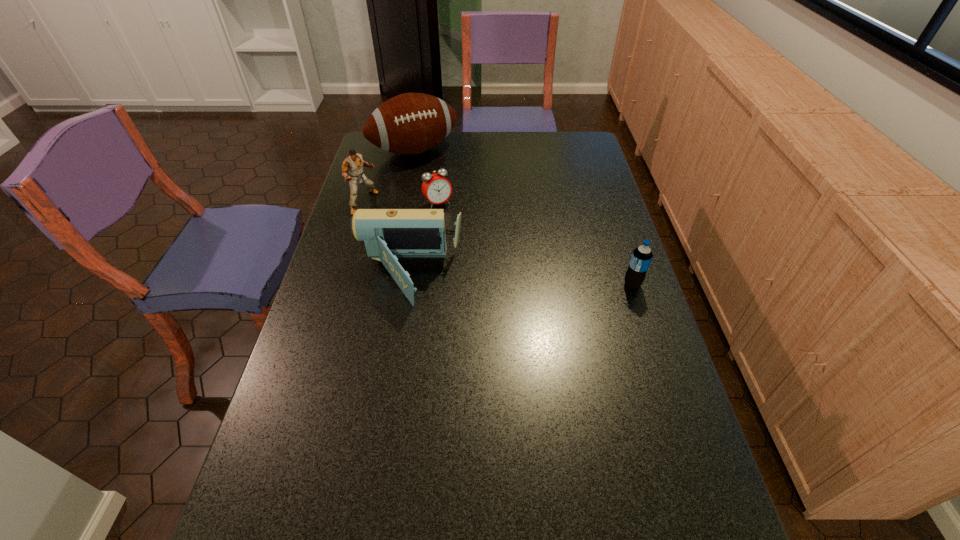
This screenshot has height=540, width=960. What are the coordinates of `free space located 0.300m on the front-facing side of the puncher` in the screenshot? It's located at (441, 245).

Image resolution: width=960 pixels, height=540 pixels. Identify the location of vacant space located 0.280m on the laces of the football. (458, 205).

In order to click on blank area located 0.180m on the laces of the football in this screenshot , I will do `click(447, 190)`.

Image resolution: width=960 pixels, height=540 pixels. I want to click on blank space located on the laces of the football, so click(469, 221).

Identify the location of vacant space located on the front-facing side of the alarm clock. This screenshot has width=960, height=540. (498, 287).

Where is `vacant space located on the front-facing side of the alarm clock`? vacant space located on the front-facing side of the alarm clock is located at coordinates (476, 255).

This screenshot has height=540, width=960. Find the location of `blank space located 0.180m on the front-facing side of the alarm clock`. blank space located 0.180m on the front-facing side of the alarm clock is located at coordinates (467, 241).

This screenshot has height=540, width=960. What are the coordinates of `object that is positioned at the far edge` in the screenshot? It's located at (411, 123).

This screenshot has width=960, height=540. I want to click on camcorder at the left edge, so click(388, 234).

You are a GUI agent. You are given a task and a screenshot of the screen. Output one action in this format:
    pyautogui.click(x=<x>, y=<y>)
    Task: Click on the puncher present at the left edge
    The image size is (960, 540).
    Given the screenshot: What is the action you would take?
    pyautogui.click(x=353, y=163)